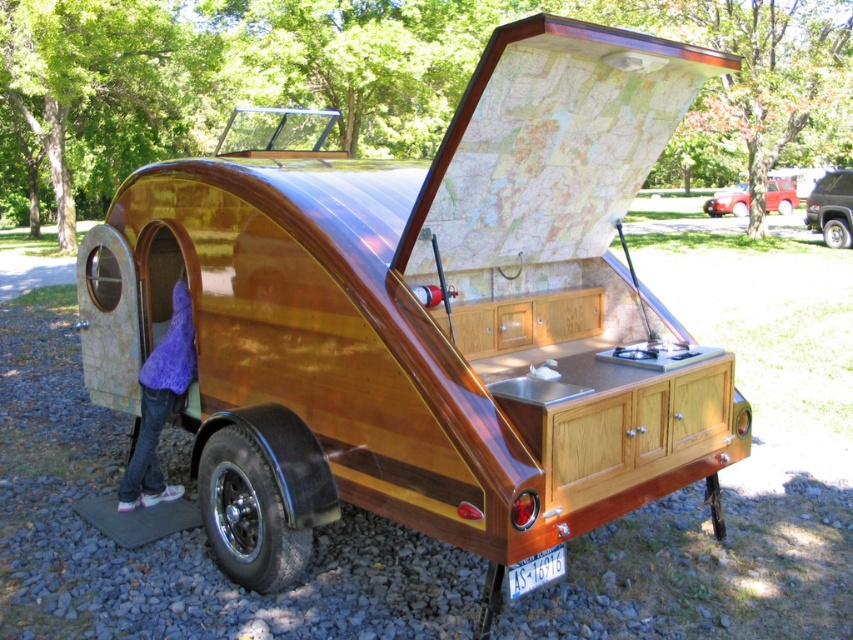
You are standing near the vintage teardrop trailer and see the purple fuzzy hat at lower left and the metallic silver suv at upper right. Which object is narrower?

The purple fuzzy hat at lower left is narrower than the metallic silver suv at upper right.

You are standing in front of the vintage teardrop trailer and notice two points marked on its surface. The first point is at coordinate point (175, 298) and the second at point (843, 241). Which of these points is closer to you?

Point (175, 298) is closer to the viewer than point (843, 241).

You are standing in front of the vintage teardrop trailer and notice the purple fuzzy hat at lower left and the metallic silver suv at upper right. Which object is closer to the ground?

The purple fuzzy hat at lower left is shorter than the metallic silver suv at upper right, so the purple fuzzy hat at lower left is closer to the ground.